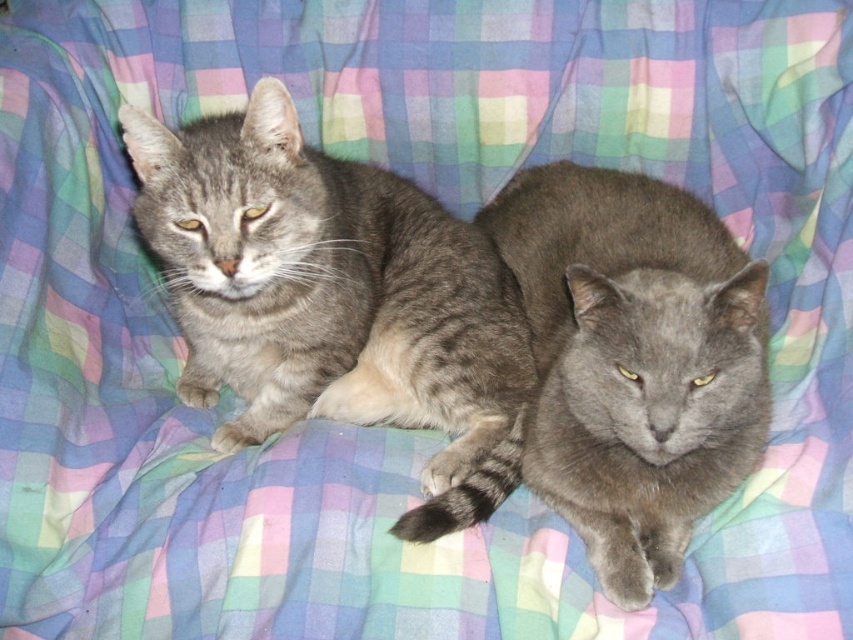
Question: Does gray tabby cat at left appear under gray fluffy cat at center?

Choices:
 (A) yes
 (B) no

Answer: (B)

Question: Can you confirm if gray tabby cat at left is thinner than gray fluffy cat at center?

Choices:
 (A) no
 (B) yes

Answer: (A)

Question: From the image, what is the correct spatial relationship of gray tabby cat at left in relation to gray fluffy cat at center?

Choices:
 (A) above
 (B) below

Answer: (A)